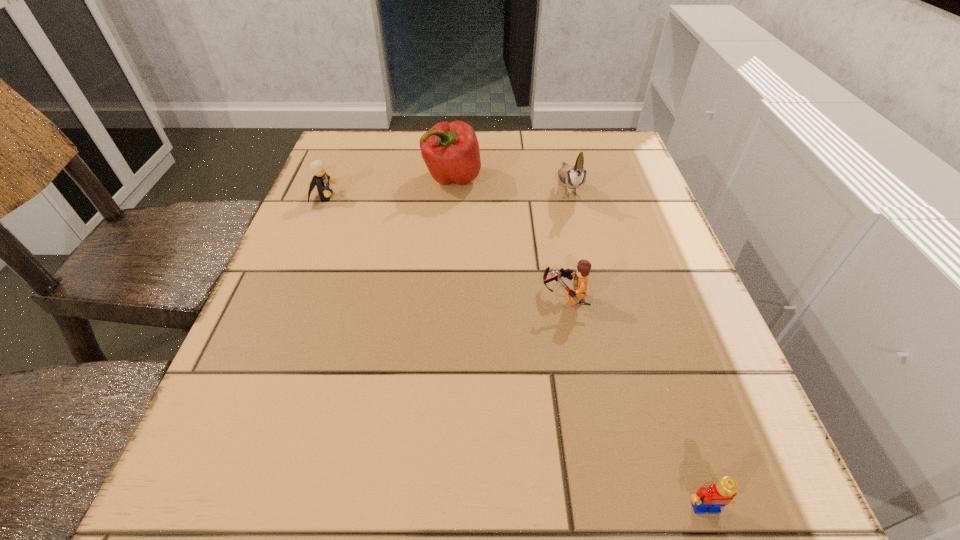
Find the location of `object located at the far right corner`. object located at the far right corner is located at coordinates (573, 177).

Image resolution: width=960 pixels, height=540 pixels. Find the location of `object that is at the near right corner`. object that is at the near right corner is located at coordinates (711, 499).

Locate an element on the screen. This screenshot has width=960, height=540. vacant space at the far edge is located at coordinates (420, 157).

The height and width of the screenshot is (540, 960). What are the coordinates of `free region at the left edge of the desktop` in the screenshot? It's located at (333, 242).

Where is `vacant space at the right edge`? This screenshot has width=960, height=540. vacant space at the right edge is located at coordinates (636, 287).

What are the coordinates of `free region at the far left corner` in the screenshot? It's located at (358, 139).

Identify the location of blank space at the near left corner of the desktop. (204, 516).

I want to click on free space between the bell pepper and the rightmost object, so click(x=579, y=343).

The height and width of the screenshot is (540, 960). Identify the location of free space between the second nearest Lego and the bird. point(566,242).

Locate an element on the screen. This screenshot has width=960, height=540. unoccupied position between the fourth object from right to left and the rightmost object is located at coordinates (579, 343).